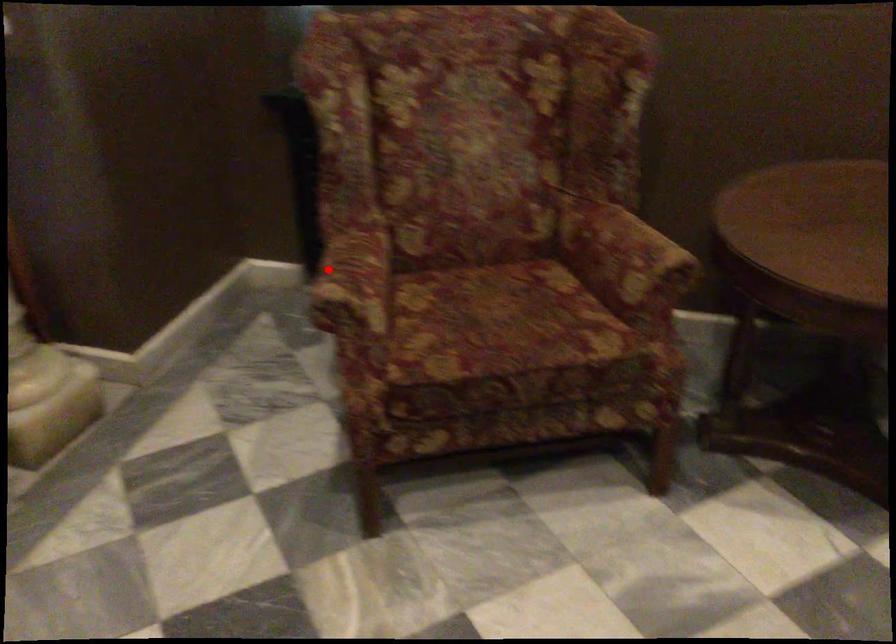
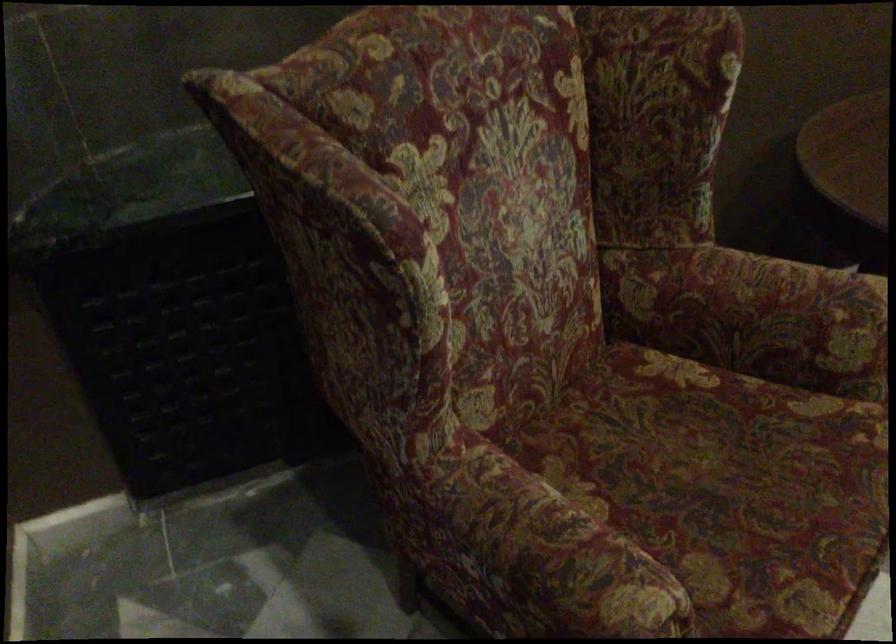
In the second image, find the point that corresponds to the highlighted location in the first image.

(543, 559)